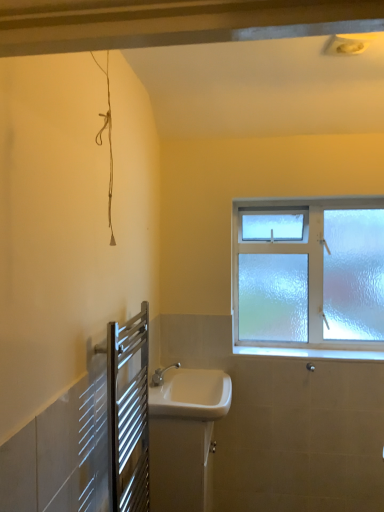
Question: Is silver metallic towel rack at lower left behind white glossy sink at lower center, the 2th sink viewed from the top?

Choices:
 (A) yes
 (B) no

Answer: (B)

Question: Is silver metallic towel rack at lower left smaller than white glossy sink at lower center, the 2th sink viewed from the top?

Choices:
 (A) yes
 (B) no

Answer: (A)

Question: From a real-world perspective, is silver metallic towel rack at lower left over white glossy sink at lower center, the 2th sink viewed from the top?

Choices:
 (A) yes
 (B) no

Answer: (A)

Question: Is silver metallic towel rack at lower left looking in the opposite direction of white glossy sink at lower center, the first sink ordered from the bottom?

Choices:
 (A) yes
 (B) no

Answer: (B)

Question: From a real-world perspective, does silver metallic towel rack at lower left sit lower than white glossy sink at lower center, the first sink ordered from the bottom?

Choices:
 (A) no
 (B) yes

Answer: (A)

Question: Does silver metallic towel rack at lower left have a greater width compared to white glossy sink at lower center, the first sink ordered from the bottom?

Choices:
 (A) yes
 (B) no

Answer: (B)

Question: Can you confirm if silver metallic towel rack at lower left is positioned to the left of white ceramic sink at center, which is counted as the 1th sink, starting from the top?

Choices:
 (A) yes
 (B) no

Answer: (A)

Question: From the image's perspective, is silver metallic towel rack at lower left located beneath white ceramic sink at center, which is counted as the 1th sink, starting from the top?

Choices:
 (A) no
 (B) yes

Answer: (A)

Question: Considering the relative positions of silver metallic towel rack at lower left and white ceramic sink at center, which is counted as the 1th sink, starting from the top, in the image provided, is silver metallic towel rack at lower left to the right of white ceramic sink at center, which is counted as the 1th sink, starting from the top, from the viewer's perspective?

Choices:
 (A) no
 (B) yes

Answer: (A)

Question: Is silver metallic towel rack at lower left thinner than white ceramic sink at center, marked as the second sink in a bottom-to-top arrangement?

Choices:
 (A) no
 (B) yes

Answer: (B)

Question: Is the depth of silver metallic towel rack at lower left less than that of white ceramic sink at center, which is counted as the 1th sink, starting from the top?

Choices:
 (A) no
 (B) yes

Answer: (B)

Question: From the image's perspective, is silver metallic towel rack at lower left on top of white ceramic sink at center, marked as the second sink in a bottom-to-top arrangement?

Choices:
 (A) no
 (B) yes

Answer: (B)

Question: Is white ceramic sink at center, which is counted as the 1th sink, starting from the top, aimed at white glossy sink at lower center, the 2th sink viewed from the top?

Choices:
 (A) no
 (B) yes

Answer: (A)